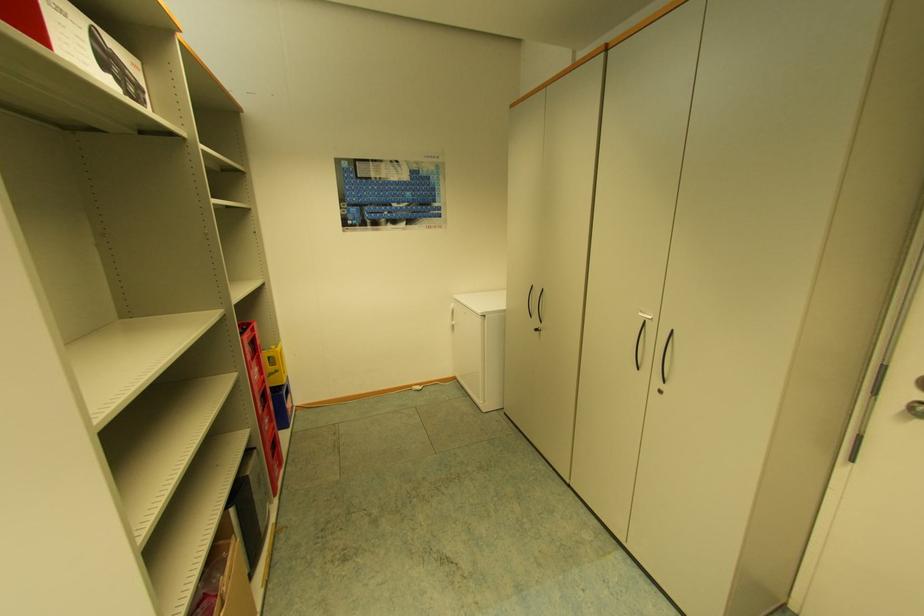
Find the location of a particular element. yellow plastic crate is located at coordinates (x=274, y=365).